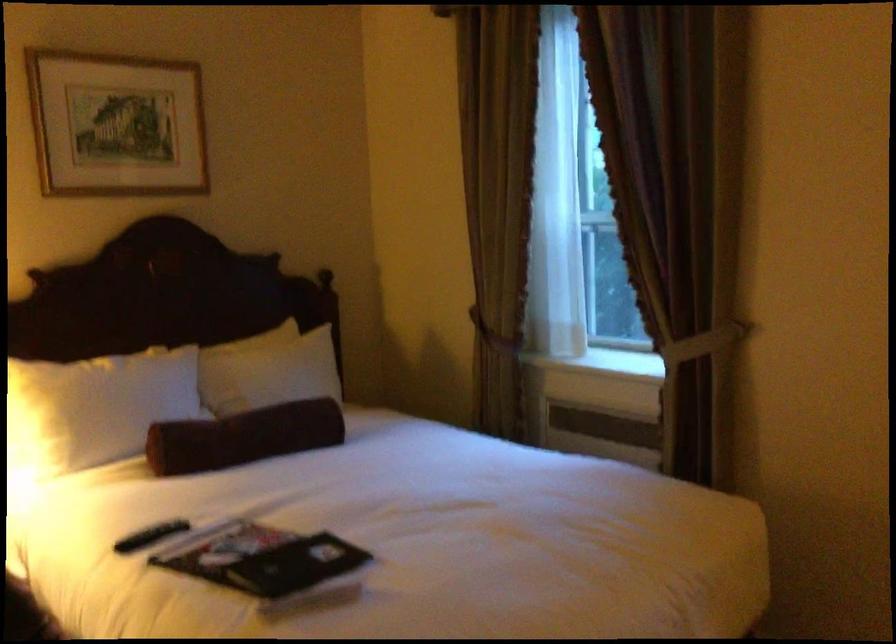
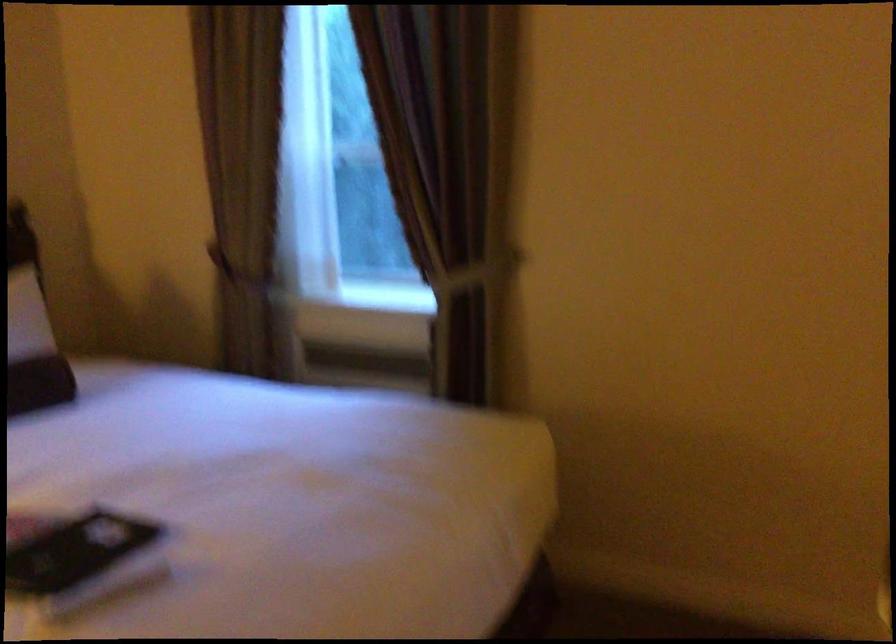
Question: How did the camera likely rotate?

Choices:
 (A) Left
 (B) Right
 (C) Up
 (D) Down

Answer: (B)